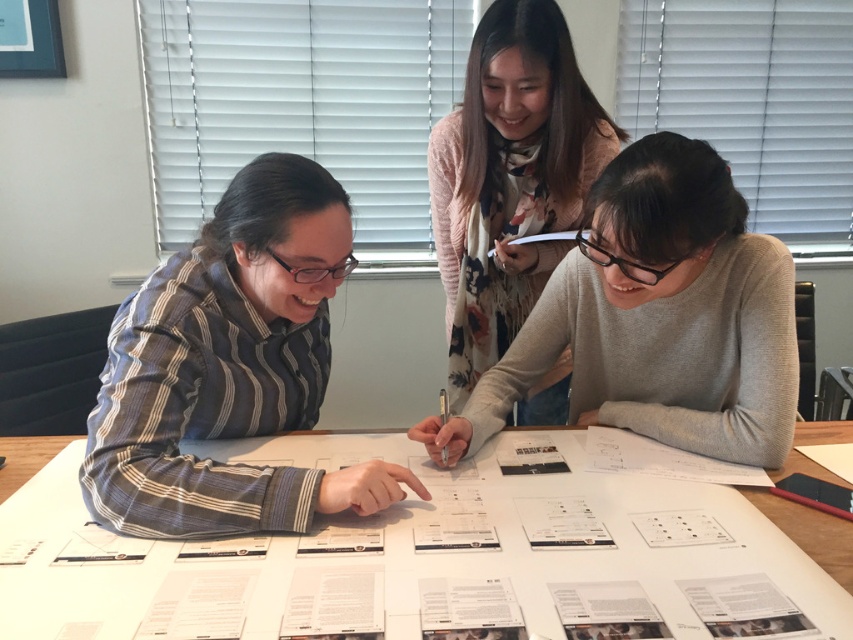
Question: Is the position of white paper at center less distant than that of floral sweater at upper center?

Choices:
 (A) yes
 (B) no

Answer: (A)

Question: Which point is closer to the camera taking this photo?

Choices:
 (A) (634, 204)
 (B) (403, 522)
 (C) (172, 384)

Answer: (A)

Question: Which point is farther to the camera?

Choices:
 (A) (601, 163)
 (B) (699, 348)
 (C) (148, 515)

Answer: (A)

Question: Does striped cotton shirt at left have a smaller size compared to gray matte sweater at center?

Choices:
 (A) no
 (B) yes

Answer: (B)

Question: Which of these objects is positioned closest to the white paper at center?

Choices:
 (A) gray matte sweater at center
 (B) striped cotton shirt at left
 (C) floral sweater at upper center

Answer: (B)

Question: Is striped cotton shirt at left to the right of floral sweater at upper center from the viewer's perspective?

Choices:
 (A) yes
 (B) no

Answer: (B)